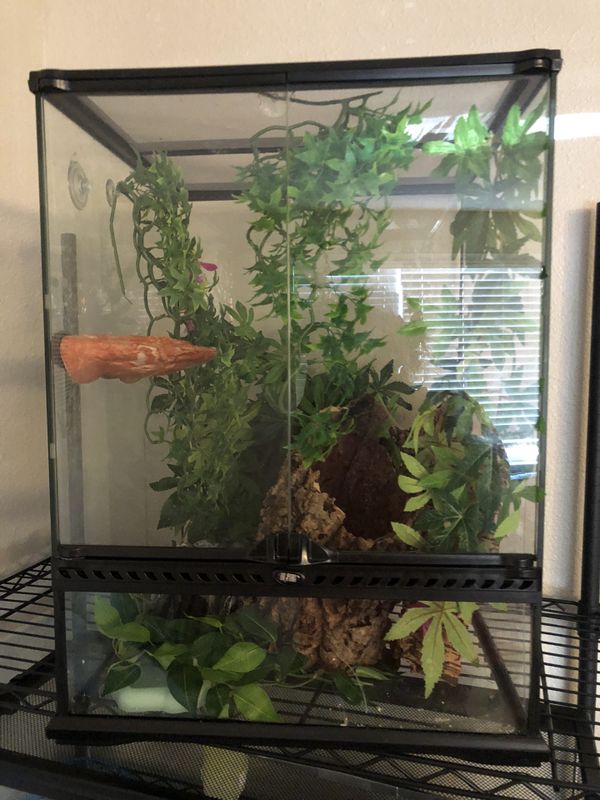
This screenshot has width=600, height=800. I want to click on suction cups, so click(x=74, y=192), click(x=110, y=198).